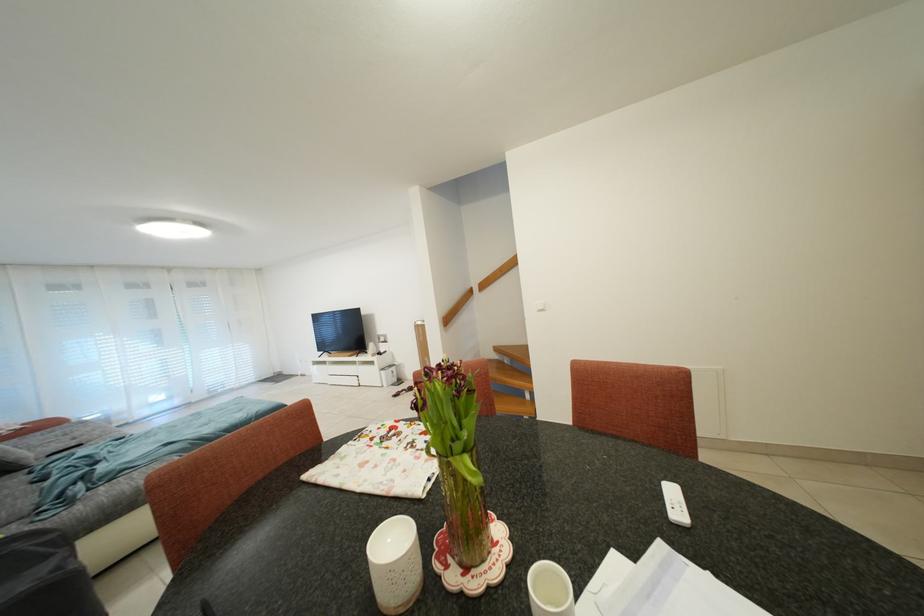
Find where to push the white light switch. Please return your answer as a coordinate pair (x, y).

(540, 306)